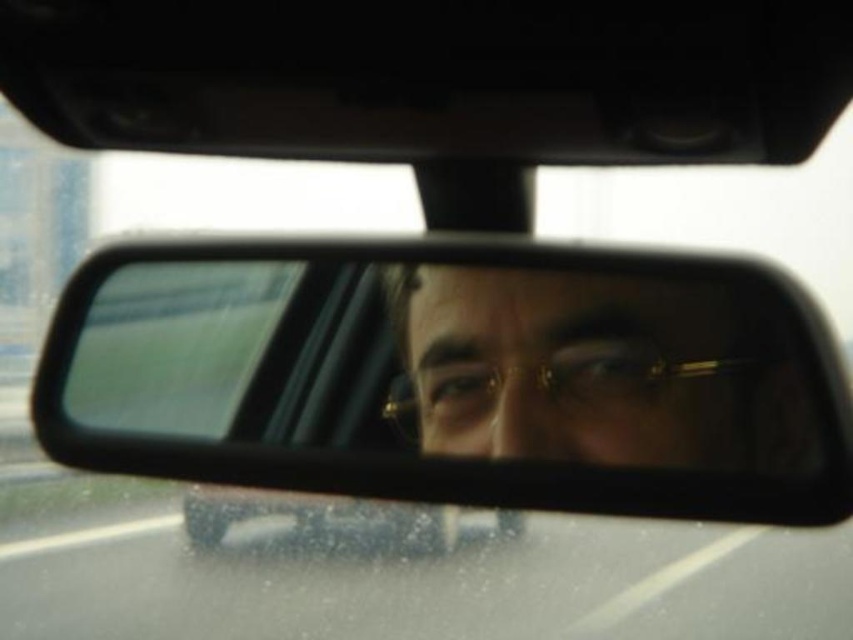
Question: Among these points, which one is nearest to the camera?

Choices:
 (A) (399, 296)
 (B) (421, 486)

Answer: (B)

Question: Does clear plastic mirror at center have a lesser width compared to gold-rimmed glasses at center?

Choices:
 (A) yes
 (B) no

Answer: (B)

Question: Which point is farther to the camera?

Choices:
 (A) gold-rimmed glasses at center
 (B) clear plastic mirror at center

Answer: (A)

Question: Is clear plastic mirror at center to the right of gold-rimmed glasses at center from the viewer's perspective?

Choices:
 (A) no
 (B) yes

Answer: (B)

Question: Can you confirm if clear plastic mirror at center is positioned to the right of gold-rimmed glasses at center?

Choices:
 (A) yes
 (B) no

Answer: (A)